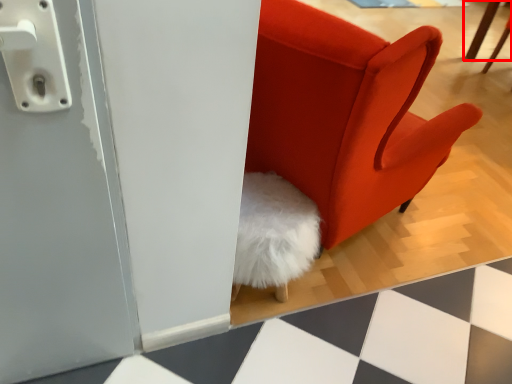
Question: From the image's perspective, considering the relative positions of furniture (annotated by the red box) and chair in the image provided, where is furniture (annotated by the red box) located with respect to the staircase?

Choices:
 (A) above
 (B) below

Answer: (A)